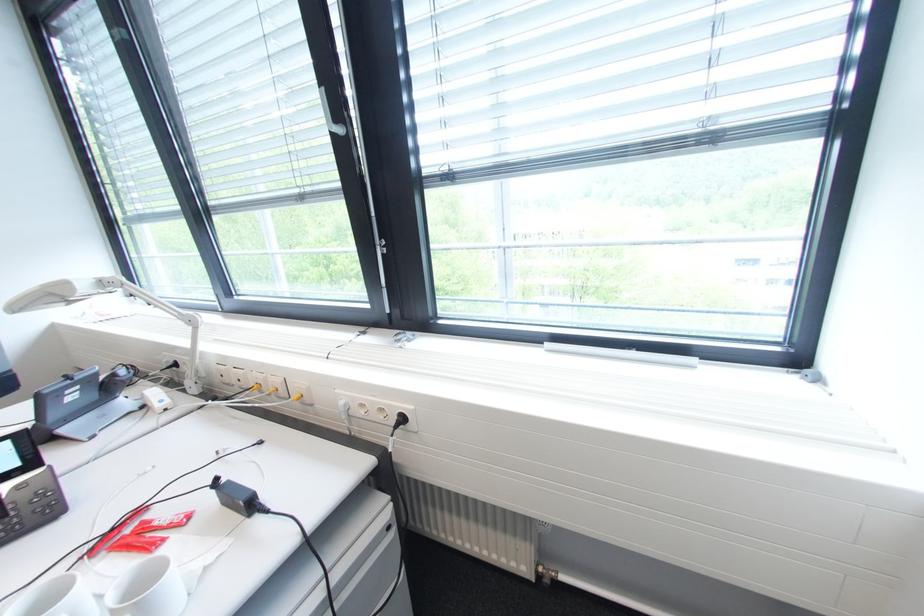
Identify the location of white lamp arm. (173, 329).